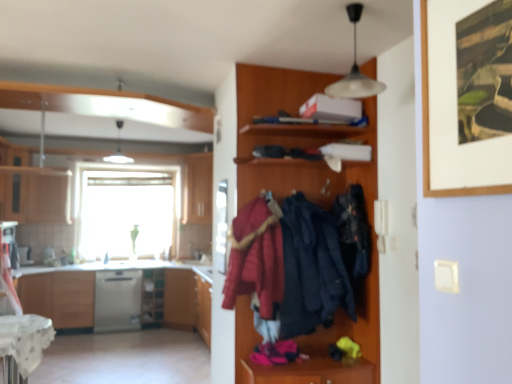
Question: From a real-world perspective, is matte wood cabinet at left, acting as the 2th cabinetry starting from the left, located beneath transparent glass screen door at center?

Choices:
 (A) yes
 (B) no

Answer: (B)

Question: Is matte wood cabinet at left, the second cabinetry when ordered from right to left, facing away from transparent glass screen door at center?

Choices:
 (A) yes
 (B) no

Answer: (B)

Question: Are matte wood cabinet at left, acting as the 2th cabinetry starting from the left, and transparent glass screen door at center far apart?

Choices:
 (A) no
 (B) yes

Answer: (B)

Question: Is matte wood cabinet at left, the second cabinetry when ordered from right to left, with transparent glass screen door at center?

Choices:
 (A) no
 (B) yes

Answer: (A)

Question: Does matte wood cabinet at left, acting as the 2th cabinetry starting from the left, have a smaller size compared to transparent glass screen door at center?

Choices:
 (A) yes
 (B) no

Answer: (B)

Question: Is matte wood cabinet at left, the second cabinetry when ordered from right to left, positioned beyond the bounds of transparent glass screen door at center?

Choices:
 (A) yes
 (B) no

Answer: (A)

Question: From the image's perspective, is matte wood cabinet at left, which is the 1th cabinetry in left-to-right order, beneath velvet red coat at center, acting as the 1th clothing starting from the left?

Choices:
 (A) no
 (B) yes

Answer: (A)

Question: Can you confirm if matte wood cabinet at left, the 3th cabinetry in the right-to-left sequence, is positioned to the left of velvet red coat at center, acting as the third clothing starting from the right?

Choices:
 (A) no
 (B) yes

Answer: (B)

Question: Does matte wood cabinet at left, the 3th cabinetry in the right-to-left sequence, have a larger size compared to velvet red coat at center, acting as the 1th clothing starting from the left?

Choices:
 (A) no
 (B) yes

Answer: (B)

Question: Is the position of matte wood cabinet at left, which is the 1th cabinetry in left-to-right order, more distant than that of velvet red coat at center, acting as the third clothing starting from the right?

Choices:
 (A) no
 (B) yes

Answer: (B)

Question: Is matte wood cabinet at left, which is the 1th cabinetry in left-to-right order, with velvet red coat at center, acting as the third clothing starting from the right?

Choices:
 (A) yes
 (B) no

Answer: (B)

Question: Does matte wood cabinet at left, which is the 1th cabinetry in left-to-right order, have a smaller size compared to velvet red coat at center, acting as the 1th clothing starting from the left?

Choices:
 (A) yes
 (B) no

Answer: (B)

Question: Is matte wood cabinet at left, the second cabinetry when ordered from right to left, looking in the opposite direction of wooden shelf at lower left?

Choices:
 (A) no
 (B) yes

Answer: (A)